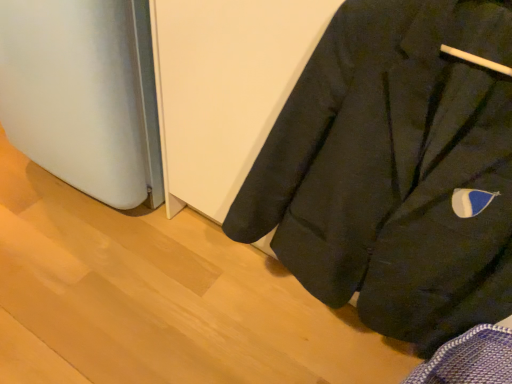
Question: Considering the positions of satin white refrigerator at lower left and black matte coat at lower right in the image, is satin white refrigerator at lower left wider or thinner than black matte coat at lower right?

Choices:
 (A) thin
 (B) wide

Answer: (B)

Question: From a real-world perspective, is satin white refrigerator at lower left physically located above or below black matte coat at lower right?

Choices:
 (A) above
 (B) below

Answer: (B)

Question: Considering the positions of point (71, 115) and point (498, 114), is point (71, 115) closer or farther from the camera than point (498, 114)?

Choices:
 (A) farther
 (B) closer

Answer: (A)

Question: In terms of height, does black matte coat at lower right look taller or shorter compared to satin white refrigerator at lower left?

Choices:
 (A) short
 (B) tall

Answer: (B)

Question: Considering their positions, is black matte coat at lower right located in front of or behind satin white refrigerator at lower left?

Choices:
 (A) front
 (B) behind

Answer: (A)

Question: From a real-world perspective, relative to satin white refrigerator at lower left, is black matte coat at lower right vertically above or below?

Choices:
 (A) above
 (B) below

Answer: (A)

Question: Is black matte coat at lower right wider or thinner than satin white refrigerator at lower left?

Choices:
 (A) wide
 (B) thin

Answer: (B)